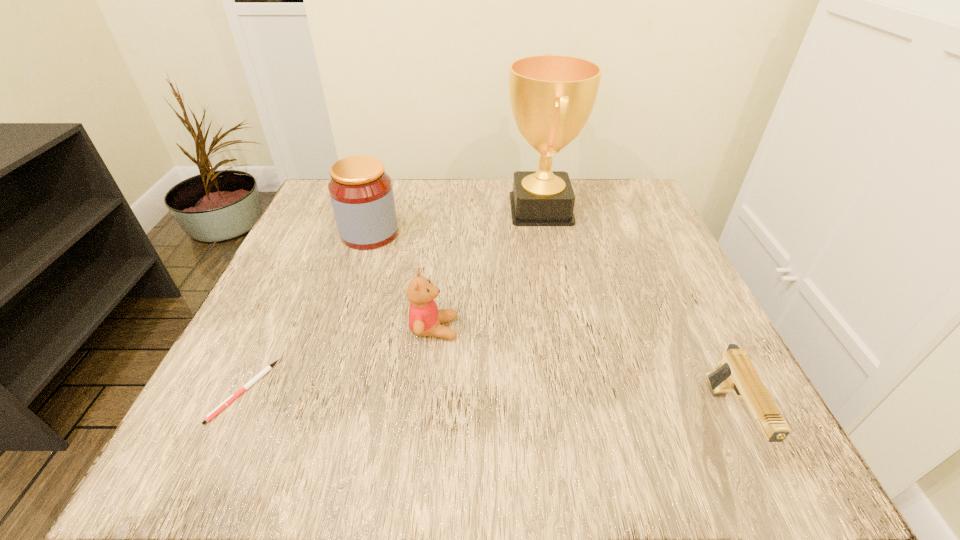
Locate an element on the screen. Image resolution: width=960 pixels, height=540 pixels. award is located at coordinates (552, 96).

Image resolution: width=960 pixels, height=540 pixels. Find the location of `the fourth object from left to right`. the fourth object from left to right is located at coordinates (552, 96).

Where is `jar`? jar is located at coordinates point(361,193).

Find the location of a particular element. Image resolution: width=960 pixels, height=540 pixels. the fourth shortest object is located at coordinates (361, 193).

The image size is (960, 540). I want to click on the third object from left to right, so click(x=425, y=319).

Find the location of a particular element. teddy bear is located at coordinates (425, 319).

Where is `pistol`? The image size is (960, 540). pistol is located at coordinates (736, 373).

You are a GUI agent. You are given a task and a screenshot of the screen. Output one action in this format:
    pyautogui.click(x=<x>, y=<y>)
    Task: Click on the rightmost object
    This screenshot has width=960, height=540.
    Given the screenshot: What is the action you would take?
    pyautogui.click(x=736, y=373)

Locate an element on the screen. the leftmost object is located at coordinates (230, 399).

I want to click on the shortest object, so 230,399.